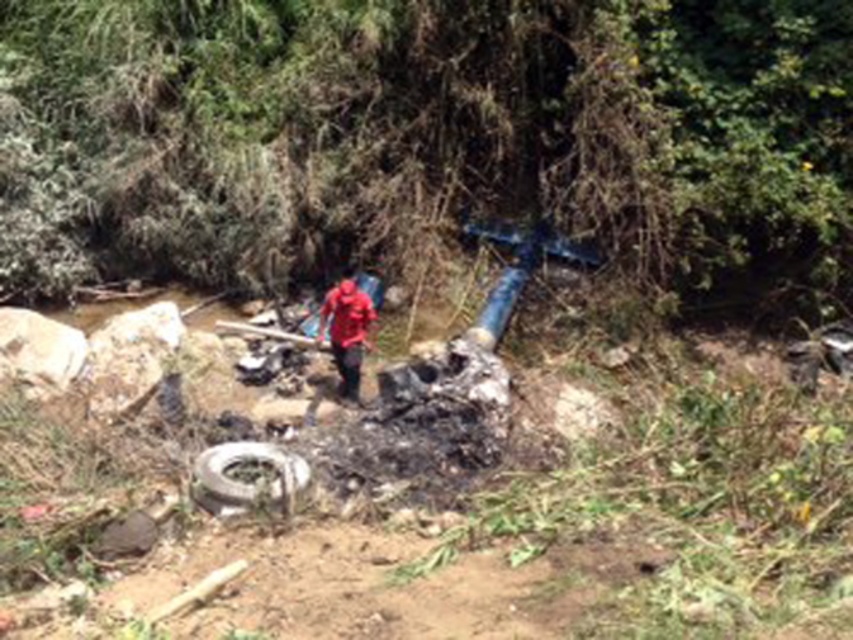
You are standing at the point with coordinates point (341, 339) and want to walk to the point with coordinates point (210, 452). Which direction should you move relative to your current position?

You should move forward because point (210, 452) is in front of point (341, 339).

You are a delivery person trying to navigate through the debris to reach the red matte jacket at center. Is the white rubber tire at lower center blocking your path?

The white rubber tire at lower center is closer to the viewer than the red matte jacket at center, so it is blocking the path to the jacket.

You are a delivery person trying to navigate through the debris in the scene. You need to move from your current position near the white rubber tire at lower center to the red matte jacket at center. Considering the tire is wider than the jacket, can you step over the tire without touching it?

The white rubber tire at lower center is wider than the red matte jacket at center. Since the tire is wider, stepping over it might be challenging and could require careful navigation to avoid touching it. The width of the tire may make it harder to step over compared to the narrower jacket.